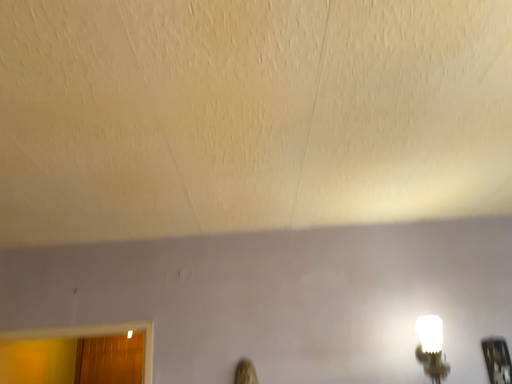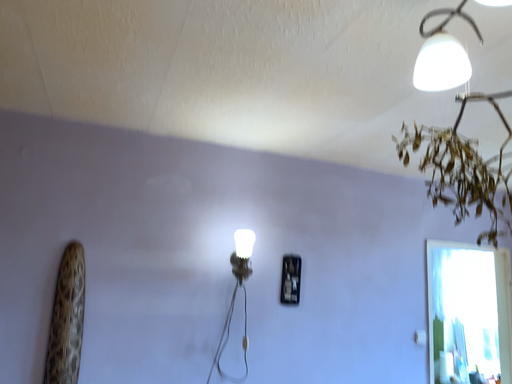
Question: How did the camera likely rotate when shooting the video?

Choices:
 (A) rotated right
 (B) rotated left

Answer: (A)